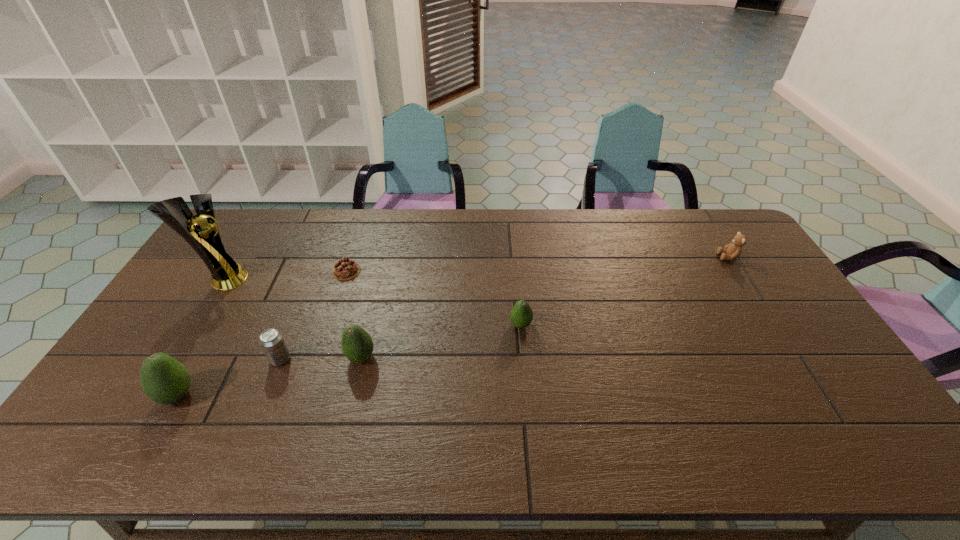
Please show where to add a avocado on the right while keeping spacing even. Please provide its 2D coordinates. Your answer should be formatted as a tuple, i.e. [(x, y)], where the tuple contains the x and y coordinates of a point satisfying the conditions above.

[(660, 296)]